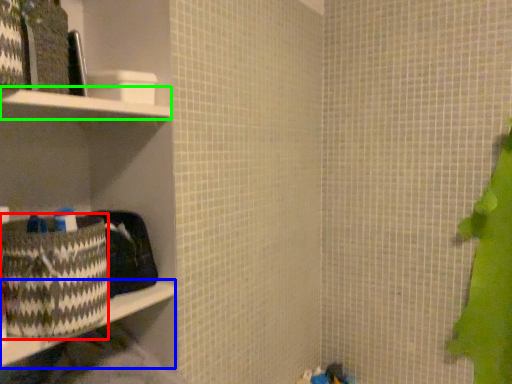
Question: Which object is positioned farthest from waste (highlighted by a red box)? Select from ledge (highlighted by a blue box) and cabinet (highlighted by a green box).

Choices:
 (A) ledge
 (B) cabinet

Answer: (B)